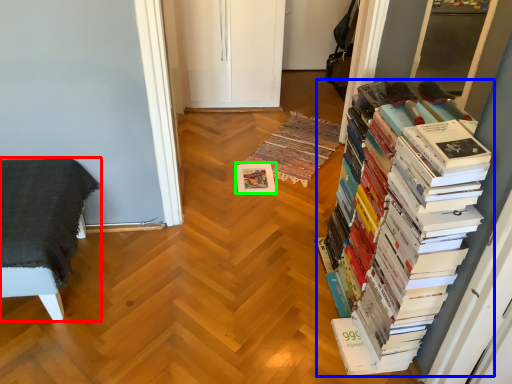
Question: Based on their relative distances, which object is nearer to furniture (highlighted by a red box)? Choose from book (highlighted by a blue box) and paperback book (highlighted by a green box).

Choices:
 (A) book
 (B) paperback book

Answer: (B)